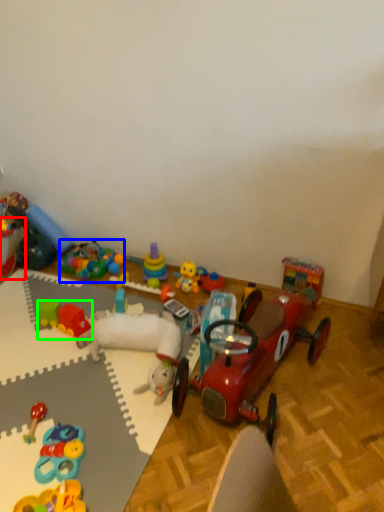
Question: Which object is the farthest from toy (highlighted by a red box)? Choose among these: toy (highlighted by a blue box) or toy (highlighted by a green box).

Choices:
 (A) toy
 (B) toy

Answer: (B)